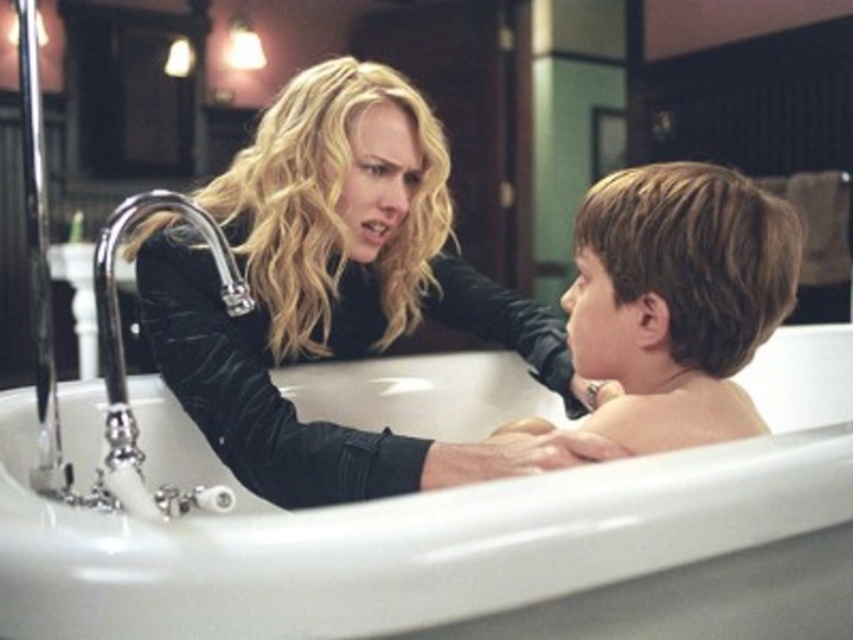
Question: Is white glossy bathtub at center positioned in front of smooth brown hair at right?

Choices:
 (A) no
 (B) yes

Answer: (B)

Question: Which point appears farthest from the camera in this image?

Choices:
 (A) click(683, 216)
 (B) click(172, 628)
 (C) click(433, 276)
 (D) click(221, 259)

Answer: (C)

Question: Based on their relative distances, which object is nearer to the smooth brown hair at right?

Choices:
 (A) polished chrome faucet at left
 (B) velvet black jacket at upper left

Answer: (B)

Question: Observing the image, what is the correct spatial positioning of smooth brown hair at right in reference to polished chrome faucet at left?

Choices:
 (A) above
 (B) below

Answer: (B)

Question: Which of these objects is positioned closest to the smooth brown hair at right?

Choices:
 (A) white glossy bathtub at center
 (B) velvet black jacket at upper left

Answer: (A)

Question: Is white glossy bathtub at center above smooth brown hair at right?

Choices:
 (A) no
 (B) yes

Answer: (A)